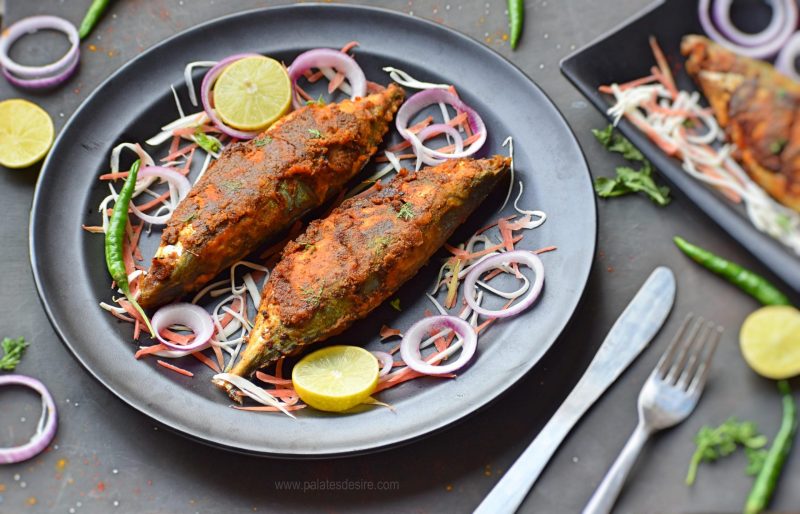
This screenshot has height=514, width=800. Find the location of `table`. table is located at coordinates (552, 39), (589, 445), (16, 405), (97, 454), (786, 492), (710, 241), (618, 405), (42, 36), (18, 77).